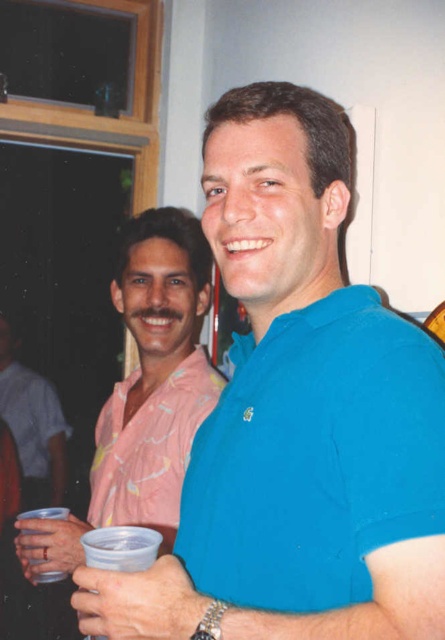
You are at a social event and want to introduce yourself to the person wearing the blue cotton shirt at center. Which direction should you move relative to the matte pink shirt at center to reach them?

The blue cotton shirt at center is to the right of the matte pink shirt at center, so you should move to the right of the matte pink shirt at center to reach them.